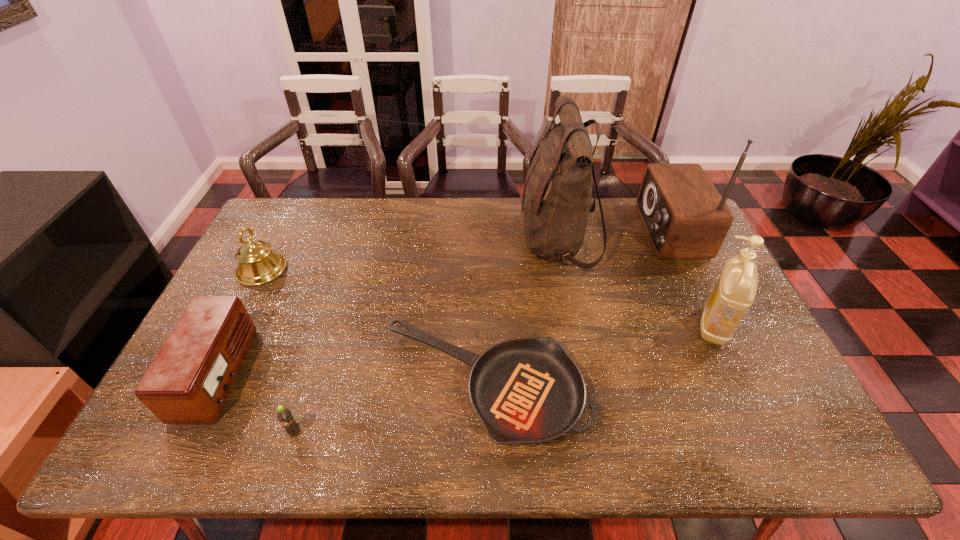
The image size is (960, 540). What are the coordinates of `vacant space that is in between the farther radio receiver and the backpack` in the screenshot? It's located at (613, 235).

I want to click on free point between the third tallest object and the backpack, so click(x=636, y=284).

I want to click on free spot between the taller radio receiver and the nearer radio receiver, so click(444, 302).

I want to click on free space between the soda and the shortest object, so click(x=390, y=408).

The width and height of the screenshot is (960, 540). I want to click on object identified as the fifth closest to the right radio receiver, so click(x=257, y=264).

Point out which object is positioned as the third nearest to the left radio receiver. Please provide its 2D coordinates. Your answer should be formatted as a tuple, i.e. [(x, y)], where the tuple contains the x and y coordinates of a point satisfying the conditions above.

[(525, 390)]

This screenshot has height=540, width=960. Identify the location of free space that satisfies the following two spatial constraints: 1. on the back side of the shortest object; 2. on the right side of the detergent. pos(484,326).

At what (x,y) coordinates should I click in order to perform the action: click on blank area in the image that satisfies the following two spatial constraints: 1. on the back side of the shortest object; 2. on the right side of the third tallest object. Please return your answer as a coordinate pair (x, y). Looking at the image, I should click on (484, 326).

Find the location of a particular element. The image size is (960, 540). vacant point that satisfies the following two spatial constraints: 1. on the open flap of the backpack; 2. on the front label of the third object from left to right is located at coordinates (594, 432).

Find the location of a particular element. vacant space that satisfies the following two spatial constraints: 1. on the front-facing side of the right radio receiver; 2. on the front label of the fifth object from right to left is located at coordinates (766, 432).